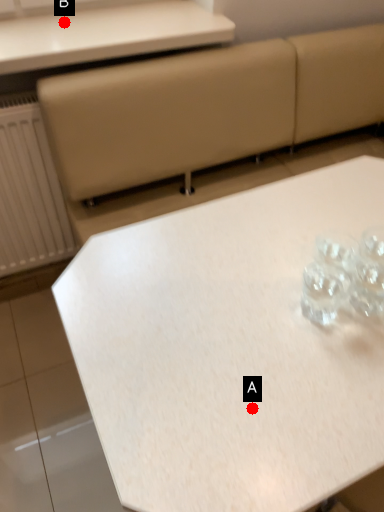
Question: Two points are circled on the image, labeled by A and B beside each circle. Which of the following is the closest to the observer?

Choices:
 (A) A is closer
 (B) B is closer

Answer: (A)